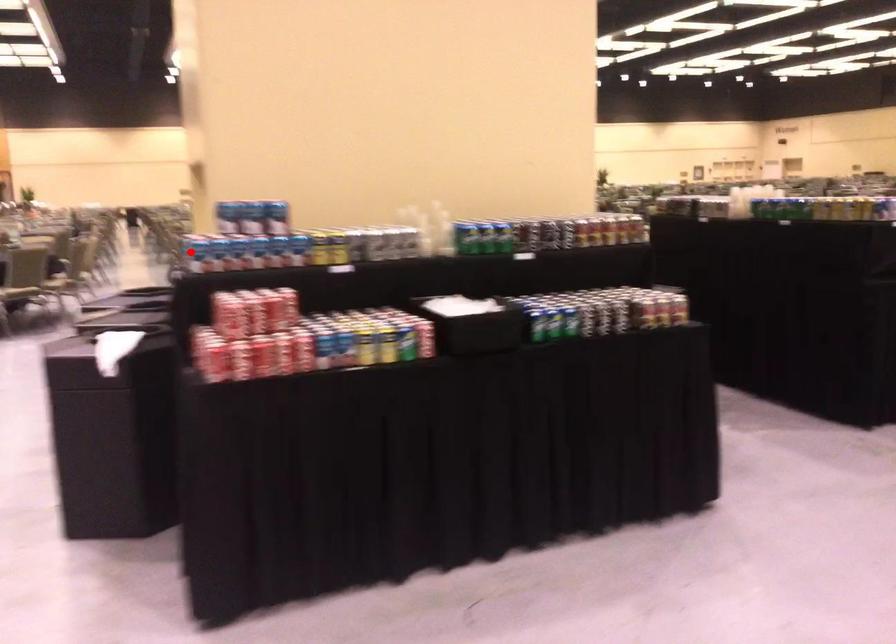
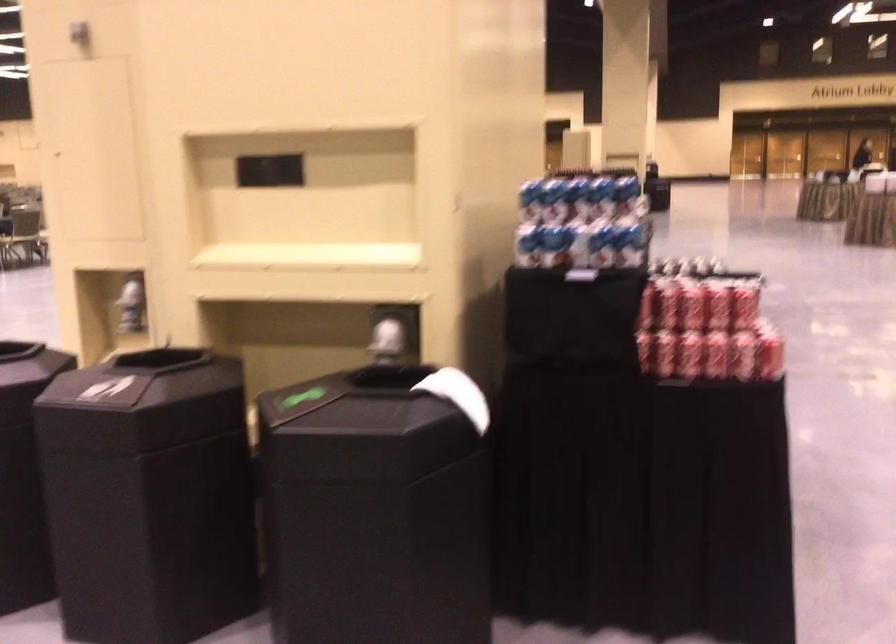
Question: I am providing you with two images of the same scene from different viewpoints. Image1 has a red point marked. In image2, the corresponding 3D location appears at what relative position? Reply with the corresponding letter.

Choices:
 (A) Closer
 (B) Farther

Answer: (A)